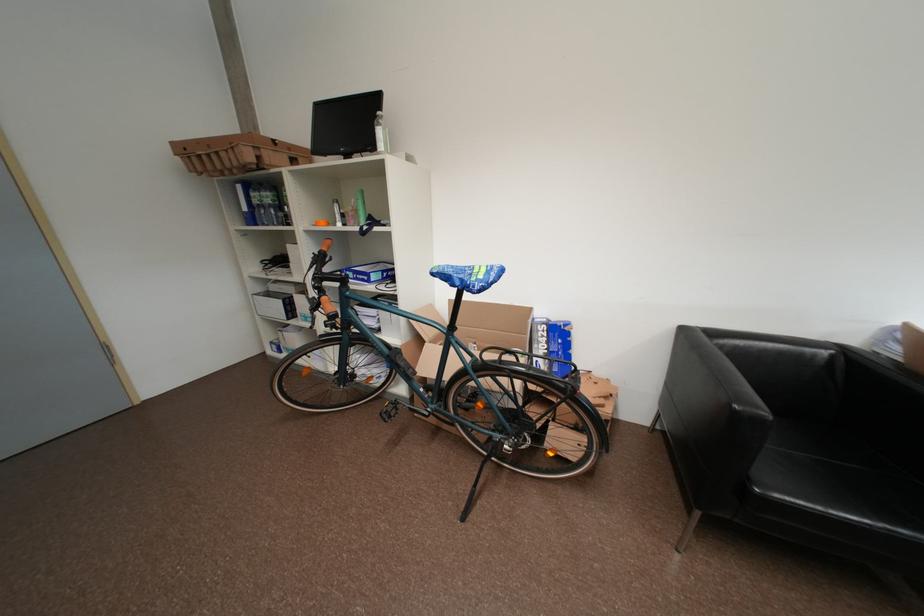
Describe the element at coordinates (713, 397) in the screenshot. This screenshot has width=924, height=616. I see `the chair armrest` at that location.